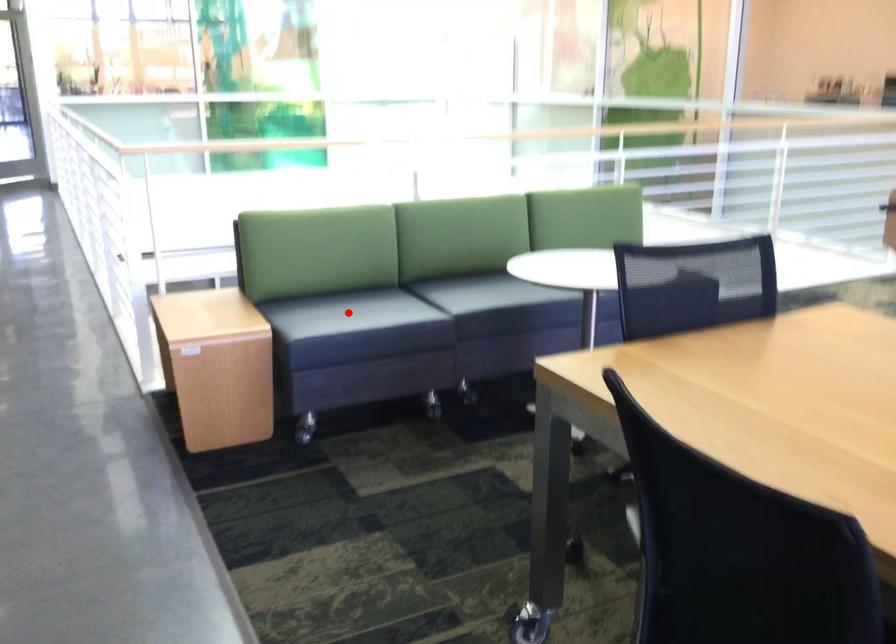
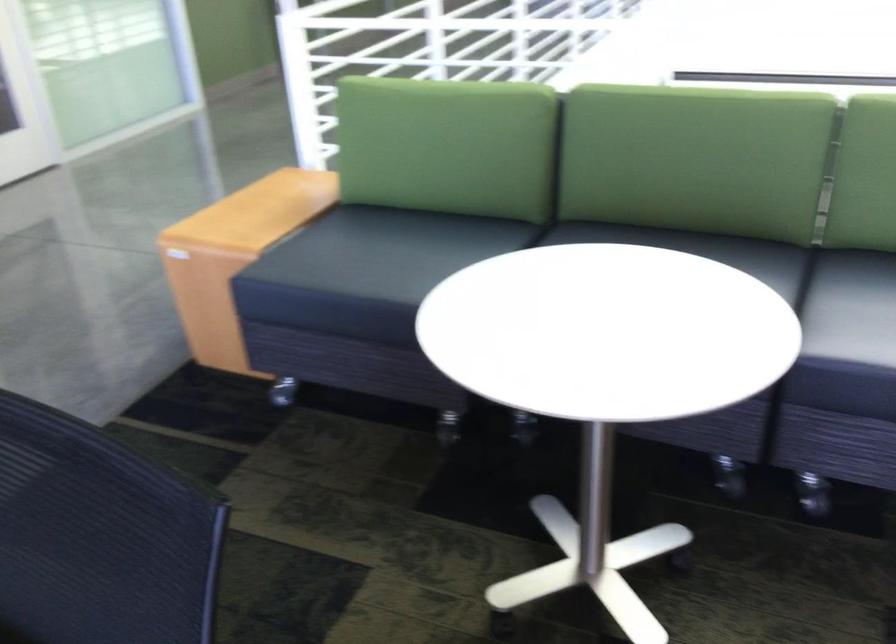
Question: I am providing you with two images of the same scene from different viewpoints. In image1, a red point is highlighted. Considering the same 3D point in image2, which of the following is correct?

Choices:
 (A) It is closer
 (B) It is farther

Answer: (A)